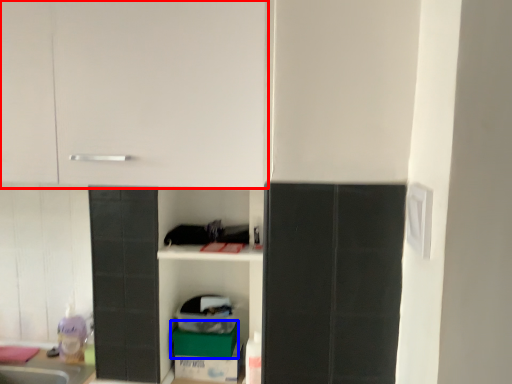
Question: Which object appears farthest to the camera in this image, cabinetry (highlighted by a red box) or cardboard box (highlighted by a blue box)?

Choices:
 (A) cabinetry
 (B) cardboard box

Answer: (B)